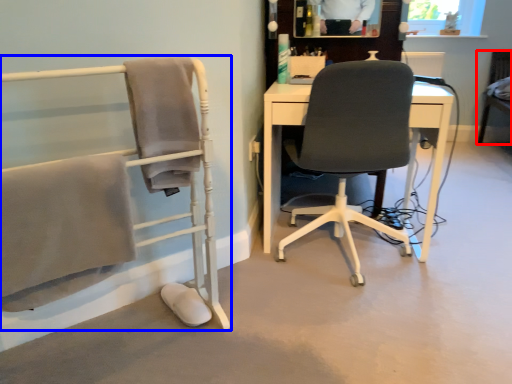
Question: Among these objects, which one is farthest to the camera, chair (highlighted by a red box) or chair (highlighted by a blue box)?

Choices:
 (A) chair
 (B) chair

Answer: (A)